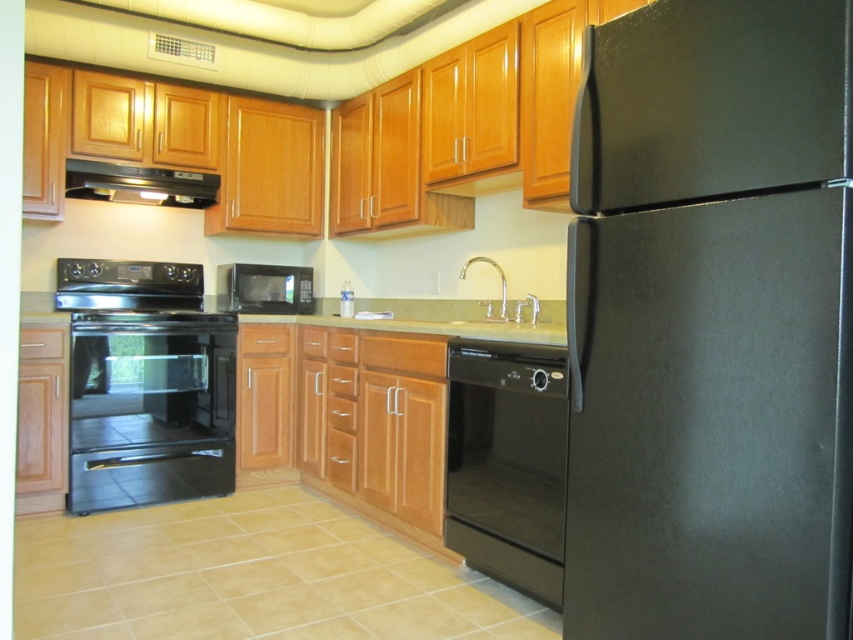
Who is positioned more to the left, stainless steel oven at left or polished chrome faucet at center?

Answer: Positioned to the left is stainless steel oven at left.

Who is higher up, stainless steel oven at left or polished chrome faucet at center?

stainless steel oven at left is higher up.

This screenshot has height=640, width=853. Find the location of `stainless steel oven at left`. stainless steel oven at left is located at coordinates (132, 289).

How distant is black matte dishwasher at lower center from stainless steel oven at left?

black matte dishwasher at lower center is 6.93 feet away from stainless steel oven at left.

Is black matte dishwasher at lower center behind stainless steel oven at left?

No, black matte dishwasher at lower center is in front of stainless steel oven at left.

The image size is (853, 640). Find the location of `black matte dishwasher at lower center`. black matte dishwasher at lower center is located at coordinates (508, 464).

Who is lower down, black matte dishwasher at lower center or black matte microwave at center?

black matte dishwasher at lower center is lower down.

Is point (491, 444) positioned before point (277, 289)?

Yes, point (491, 444) is in front of point (277, 289).

This screenshot has width=853, height=640. Find the location of `black matte dishwasher at lower center`. black matte dishwasher at lower center is located at coordinates (508, 464).